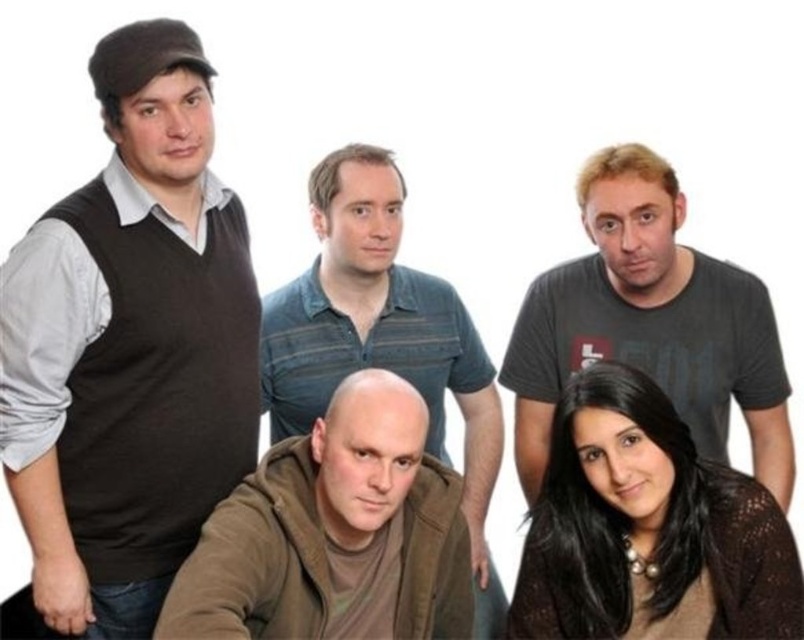
Question: Which point appears closest to the camera in this image?

Choices:
 (A) (224, 404)
 (B) (396, 602)
 (C) (483, 634)

Answer: (A)

Question: Estimate the real-world distances between objects in this image. Which object is farther from the brown striped shirt at center?

Choices:
 (A) dark gray t-shirt at upper right
 (B) brown knitted sweater at lower right
 (C) matte black sweater vest at left
 (D) brown matte hoodie at lower center

Answer: (B)

Question: Is matte black sweater vest at left thinner than dark gray t-shirt at upper right?

Choices:
 (A) no
 (B) yes

Answer: (B)

Question: Which of these objects is positioned closest to the matte black sweater vest at left?

Choices:
 (A) brown matte hoodie at lower center
 (B) dark gray t-shirt at upper right

Answer: (A)

Question: Can you confirm if matte black sweater vest at left is smaller than brown knitted sweater at lower right?

Choices:
 (A) yes
 (B) no

Answer: (B)

Question: Does brown matte hoodie at lower center have a lesser width compared to dark gray t-shirt at upper right?

Choices:
 (A) yes
 (B) no

Answer: (A)